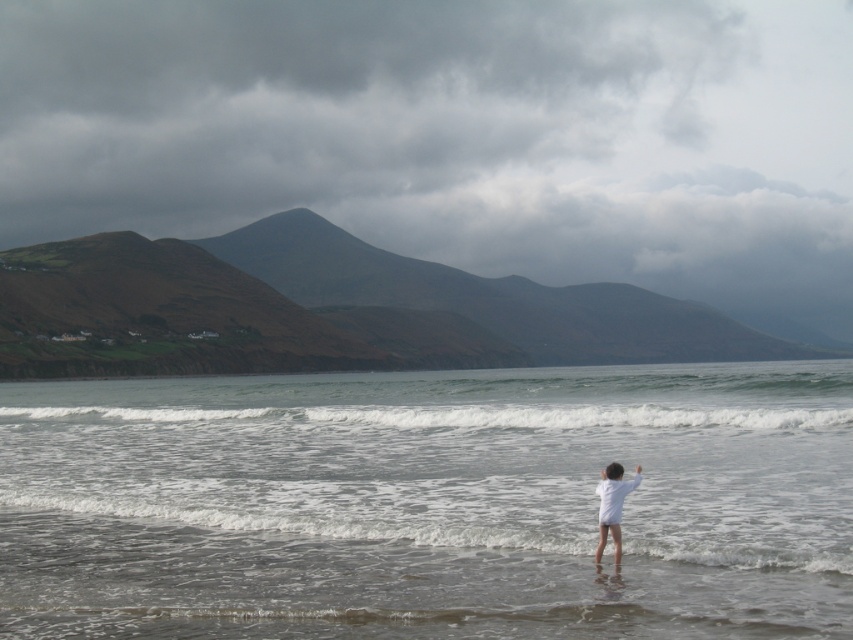
You are a photographer trying to capture the clear water at lower center and the white foamy wave at center in the same frame. Based on their heights, which object should appear larger in your photo?

The clear water at lower center should appear larger in the photo because it has a greater height compared to the white foamy wave at center.

You are a photographer planning to take a picture of the clear water at lower center and the white matte shirt at lower right. Which object should you focus on first if you want to capture both in sharp detail?

The clear water at lower center should be focused on first because it is larger in size than the white matte shirt at lower right, allowing for better depth of field coverage.